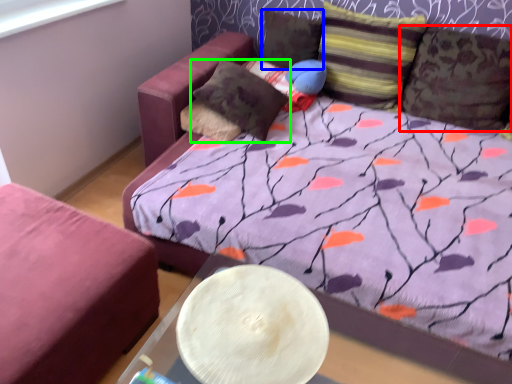
Question: Which object is positioned farthest from pillow (highlighted by a red box)? Select from pillow (highlighted by a blue box) and pillow (highlighted by a green box).

Choices:
 (A) pillow
 (B) pillow

Answer: (B)